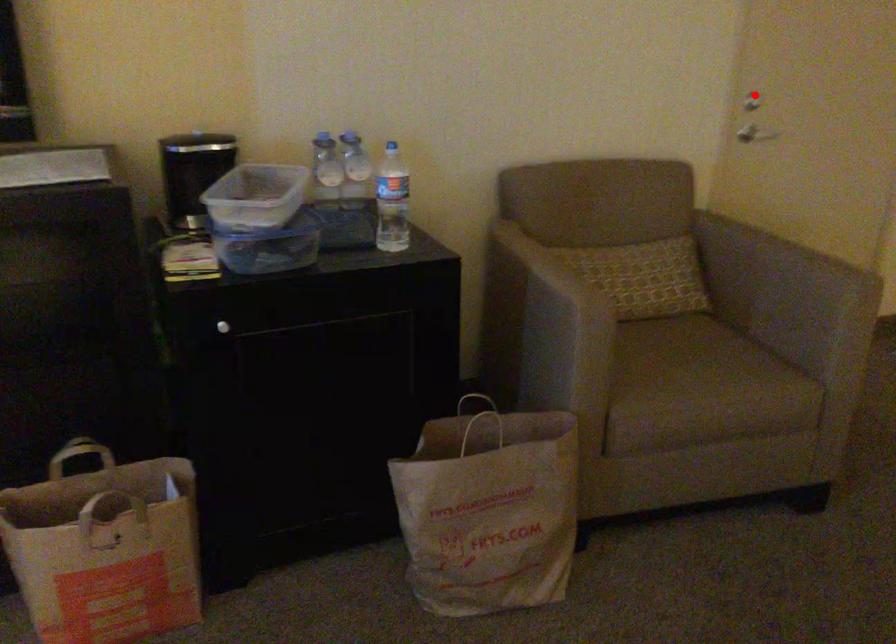
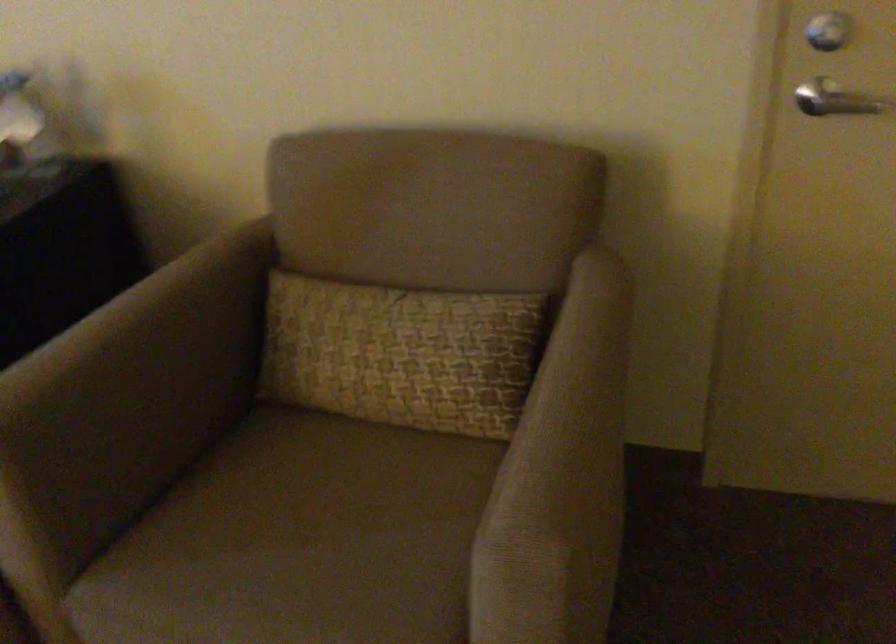
Question: I am providing you with two images of the same scene from different viewpoints. Image1 has a red point marked. In image2, the corresponding 3D location appears at what relative position? Reply with the corresponding letter.

Choices:
 (A) Closer
 (B) Farther

Answer: (A)